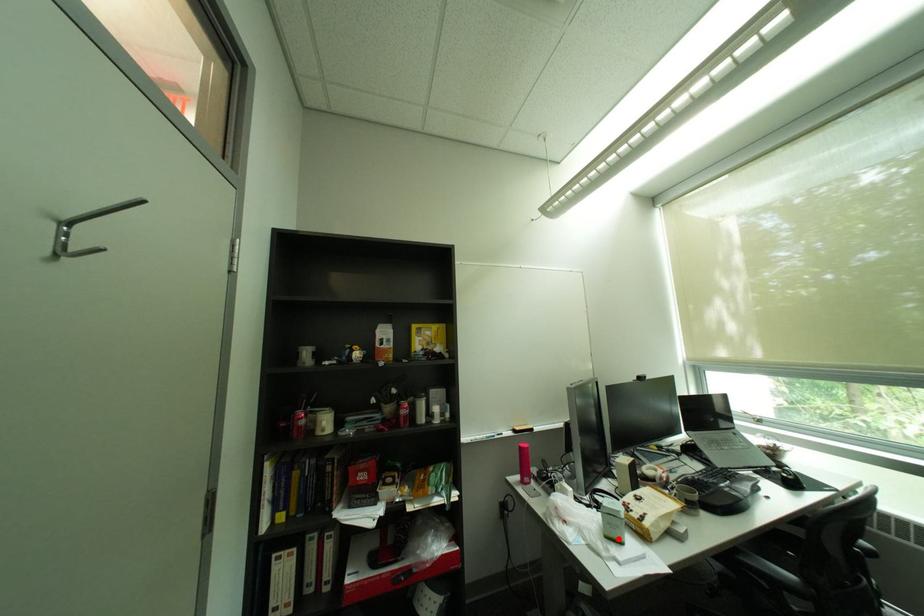
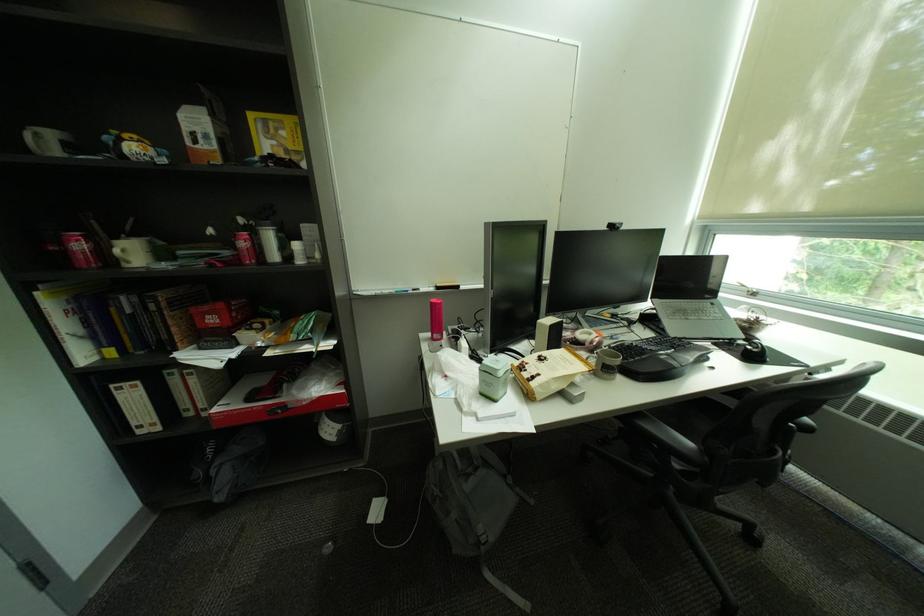
Locate, in the second image, the point that corresponds to the highlighted location in the first image.

(492, 395)